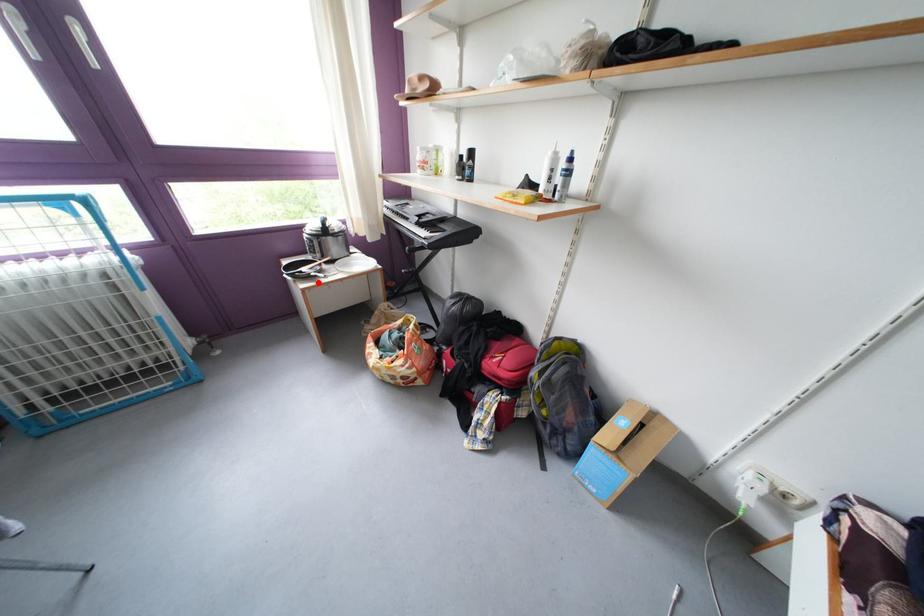
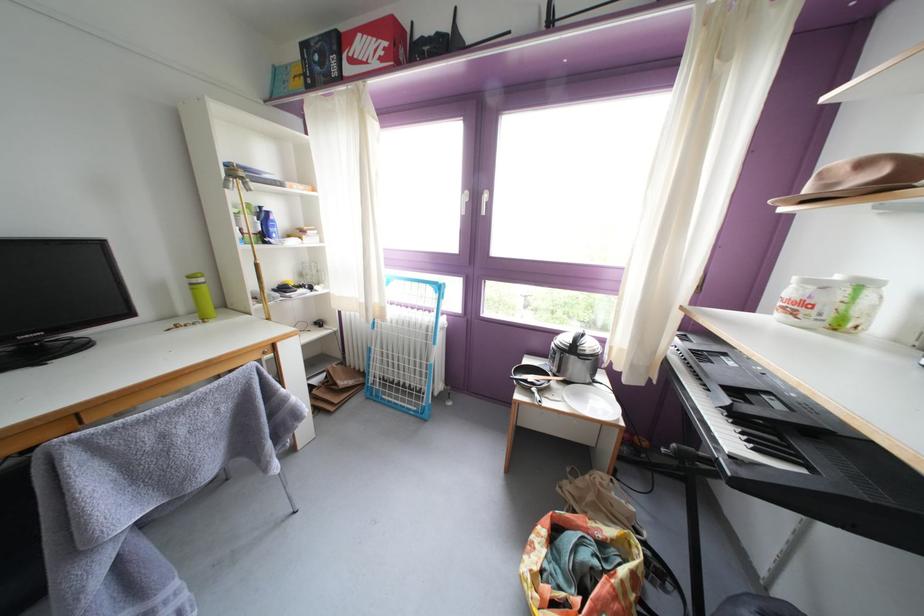
Question: I am providing you with two images of the same scene from different viewpoints. A red point is marked on the first image. Is the red point's position out of view in image 2?

Choices:
 (A) Yes
 (B) No

Answer: (A)